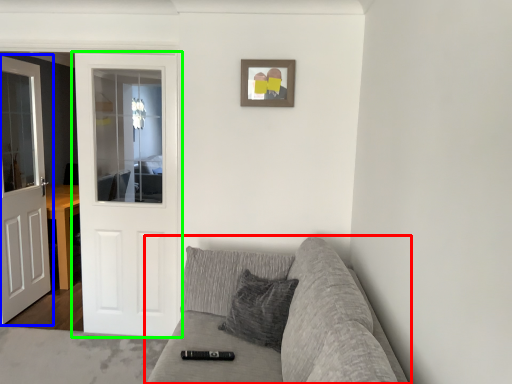
Question: Which object is the closest to the studio couch (highlighted by a red box)? Choose among these: door (highlighted by a blue box) or door (highlighted by a green box).

Choices:
 (A) door
 (B) door

Answer: (A)